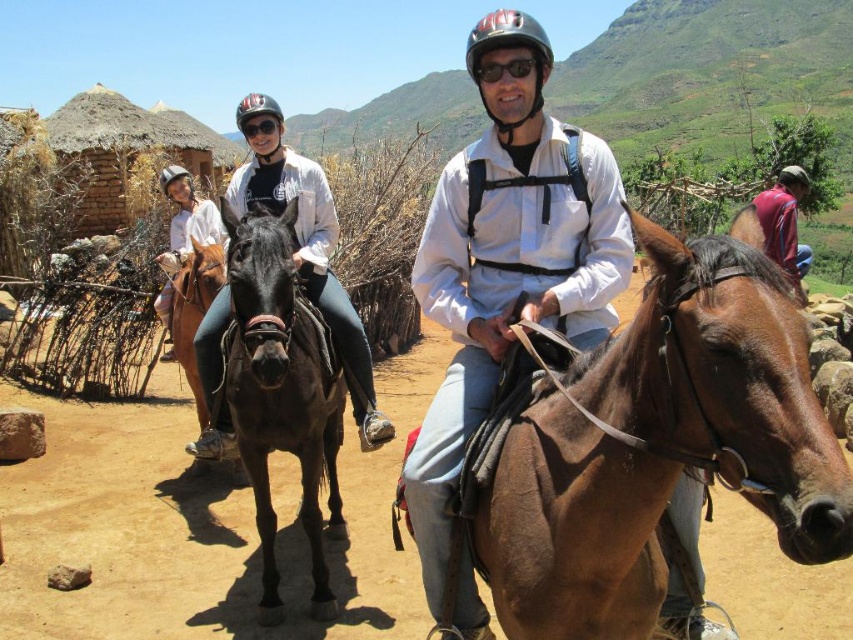
Question: Which point is farther to the camera?

Choices:
 (A) matte white jacket at center
 (B) purple fabric shirt at upper right
 (C) shiny brown horse at center

Answer: (B)

Question: Is shiny black horse at center wider than black matte goggles at upper center?

Choices:
 (A) no
 (B) yes

Answer: (B)

Question: Which of these objects is positioned farthest from the sunglasses at center?

Choices:
 (A) brushed metal helmet at upper center
 (B) shiny brown horse at center
 (C) matte white jacket at center

Answer: (B)

Question: Is brushed metal helmet at upper center wider than shiny brown horse at center?

Choices:
 (A) no
 (B) yes

Answer: (B)

Question: Can you confirm if brushed metal helmet at upper center is positioned to the right of purple fabric shirt at upper right?

Choices:
 (A) yes
 (B) no

Answer: (B)

Question: Estimate the real-world distances between objects in this image. Which object is closer to the matte white shirt at left?

Choices:
 (A) brown glossy horse at center
 (B) purple fabric shirt at upper right
 (C) black matte goggles at upper center

Answer: (C)